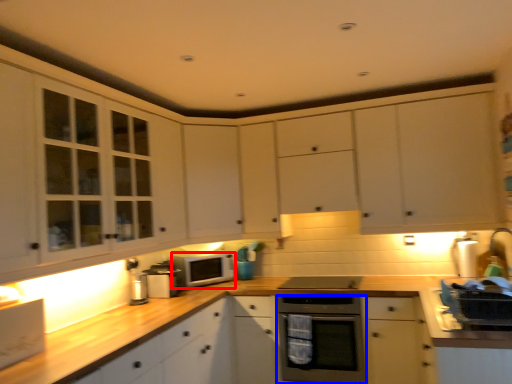
Question: Which object appears farthest to the camera in this image, microwave oven (highlighted by a red box) or home appliance (highlighted by a blue box)?

Choices:
 (A) microwave oven
 (B) home appliance

Answer: (A)